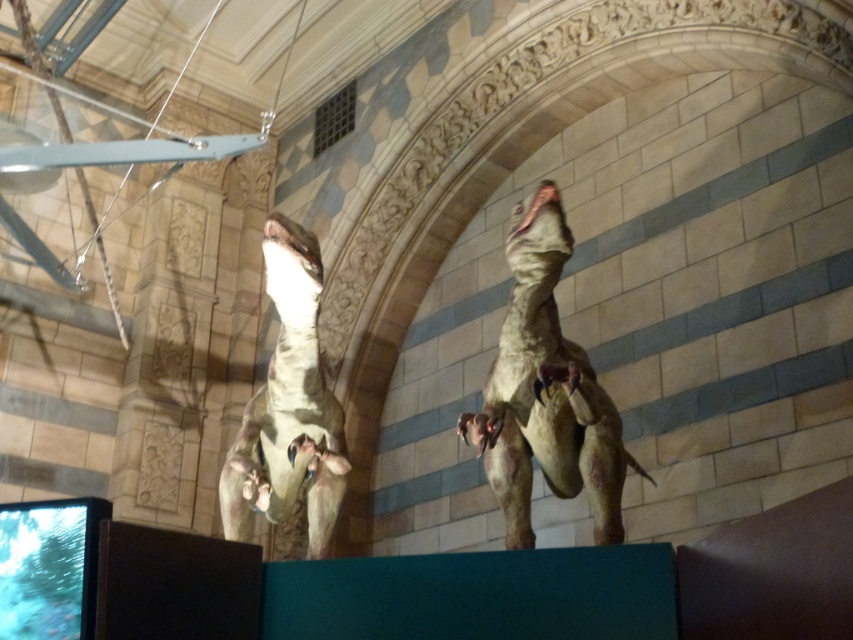
Question: Which object appears farthest from the camera in this image?

Choices:
 (A) matte brown dinosaur at upper center
 (B) matte brown dinosaur at left

Answer: (B)

Question: Does matte brown dinosaur at upper center appear on the right side of matte brown dinosaur at left?

Choices:
 (A) yes
 (B) no

Answer: (A)

Question: Is matte brown dinosaur at upper center positioned behind matte brown dinosaur at left?

Choices:
 (A) yes
 (B) no

Answer: (B)

Question: Can you confirm if matte brown dinosaur at upper center is positioned to the left of matte brown dinosaur at left?

Choices:
 (A) no
 (B) yes

Answer: (A)